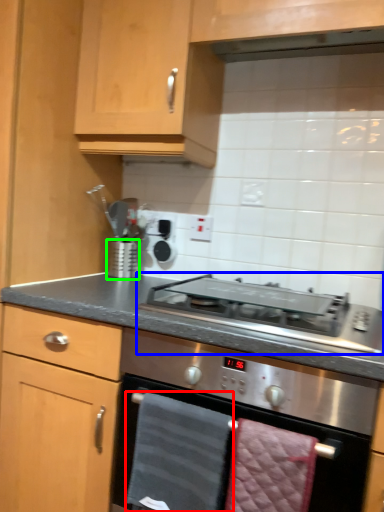
Question: Which object is positioned farthest from hand towel (highlighted by a red box)? Select from gas stove (highlighted by a blue box) and kitchen appliance (highlighted by a green box).

Choices:
 (A) gas stove
 (B) kitchen appliance

Answer: (B)